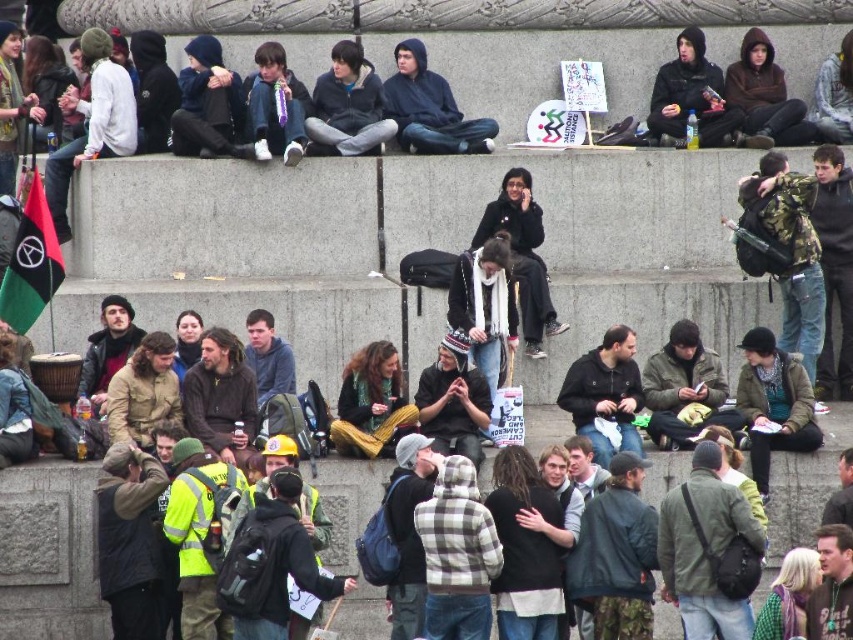
Question: Can you confirm if dark blue hoodie at center is thinner than dark gray hoodie at upper right?

Choices:
 (A) yes
 (B) no

Answer: (A)

Question: Which point is closer to the camera?

Choices:
 (A) dark gray hoodie at upper right
 (B) dark blue hoodie at center

Answer: (B)

Question: Which object appears closest to the camera in this image?

Choices:
 (A) dark blue hoodie at center
 (B) dark gray hoodie at upper right

Answer: (A)

Question: Observing the image, what is the correct spatial positioning of dark blue hoodie at center in reference to dark gray hoodie at upper right?

Choices:
 (A) below
 (B) above

Answer: (A)

Question: Is dark blue hoodie at center above dark gray hoodie at upper right?

Choices:
 (A) yes
 (B) no

Answer: (B)

Question: Among these objects, which one is nearest to the camera?

Choices:
 (A) dark gray hoodie at upper right
 (B) dark blue hoodie at center

Answer: (B)